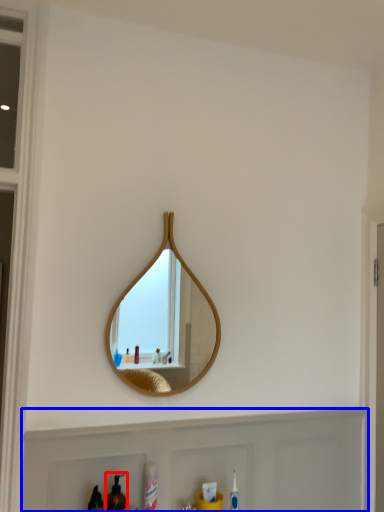
Question: Which object appears closest to the camera in this image, mouthwash (highlighted by a red box) or cabinet (highlighted by a blue box)?

Choices:
 (A) mouthwash
 (B) cabinet

Answer: (A)